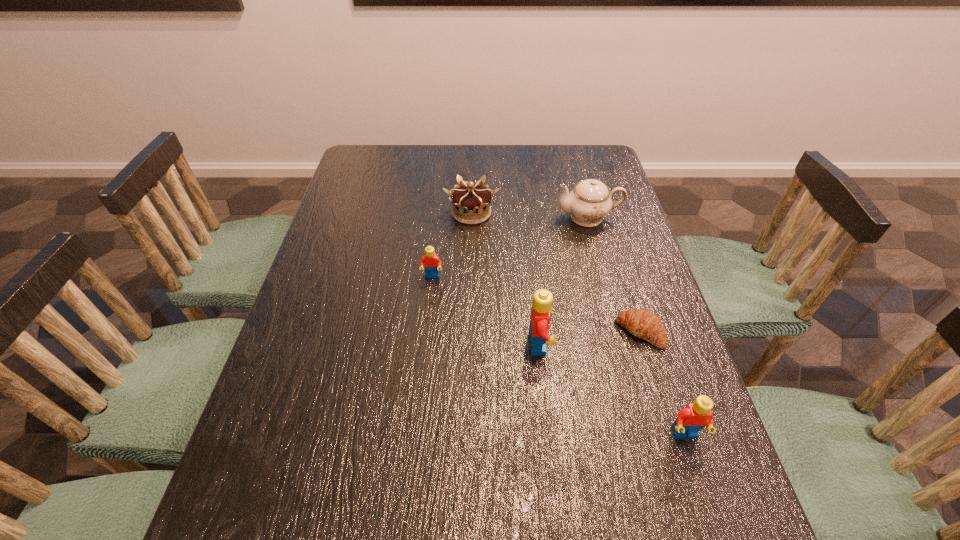
Please point a spot to add another Lego on the left. Please provide its 2D coordinates. Your answer should be formatted as a tuple, i.e. [(x, y)], where the tuple contains the x and y coordinates of a point satisfying the conditions above.

[(349, 225)]